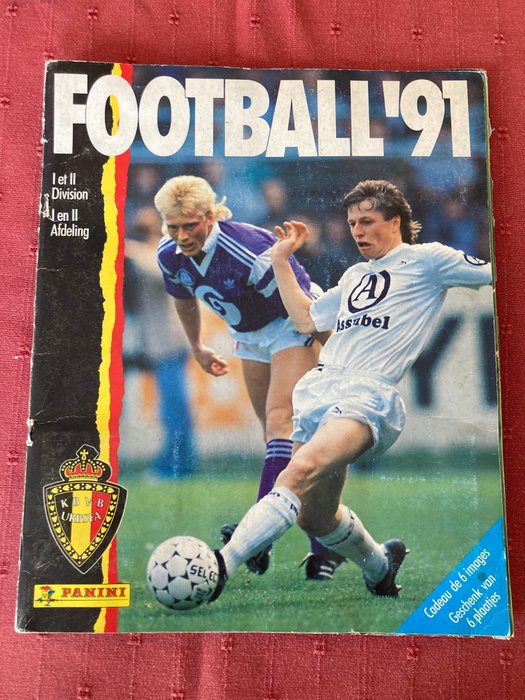
Where is `red cloth`? This screenshot has width=525, height=700. red cloth is located at coordinates (21, 308).